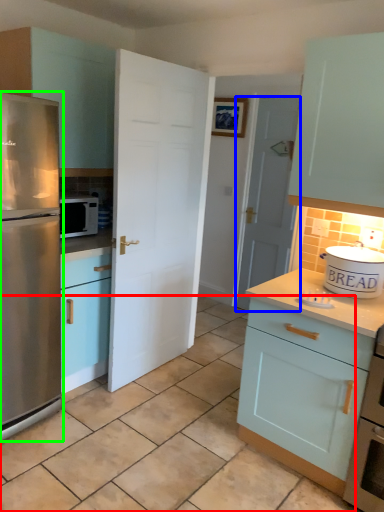
Question: Which object is the closest to the tile (highlighted by a red box)? Choose among these: door (highlighted by a blue box) or refrigerator (highlighted by a green box).

Choices:
 (A) door
 (B) refrigerator

Answer: (B)